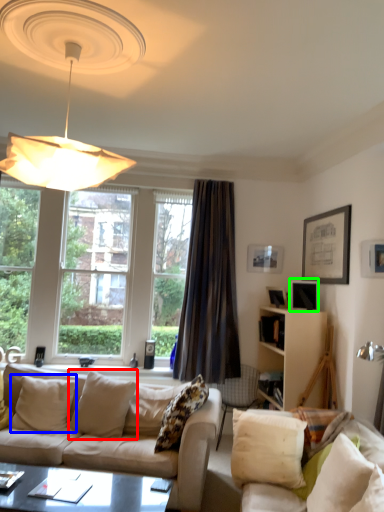
Question: Based on their relative distances, which object is farther from pillow (highlighted by a red box)? Choose from pillow (highlighted by a blue box) and picture frame (highlighted by a green box).

Choices:
 (A) pillow
 (B) picture frame

Answer: (B)